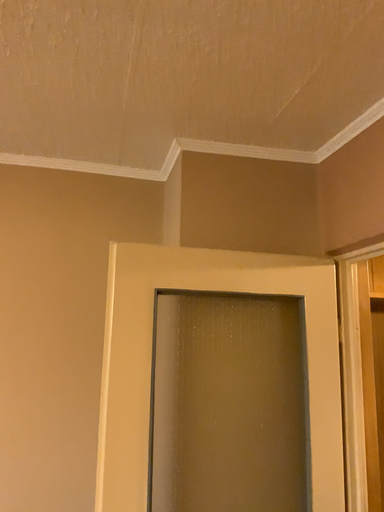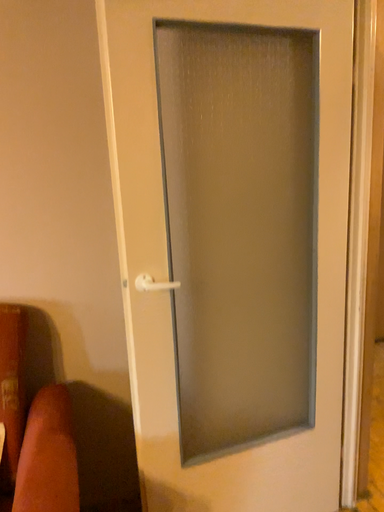
Question: How did the camera likely rotate when shooting the video?

Choices:
 (A) rotated upward
 (B) rotated downward

Answer: (B)